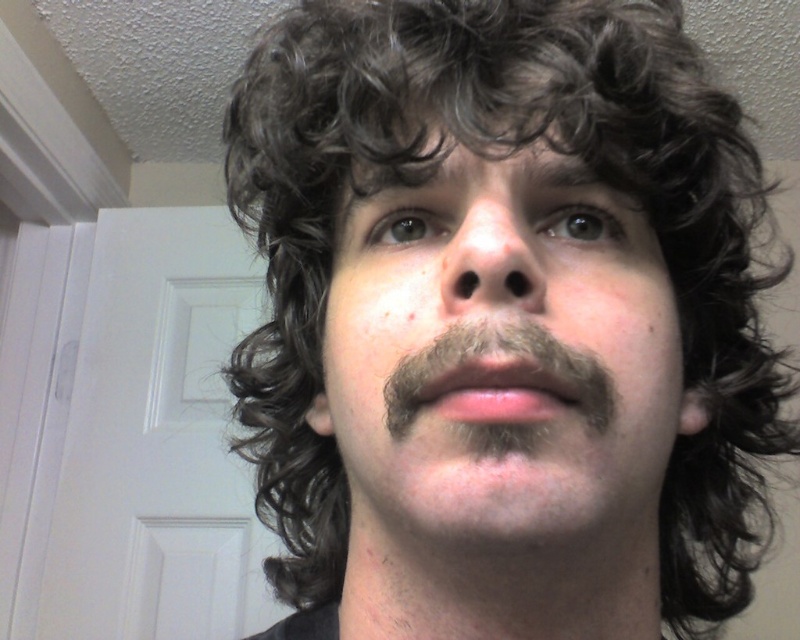
You are a barber who needs to trim the dark curly hair at center and the dark brown fuzzy mustache at center. Which one requires a longer blade length to accommodate its height?

The dark curly hair at center is much taller than the dark brown fuzzy mustache at center, so the barber should use a longer blade length for the dark curly hair at center.

Looking at this image, you are standing in front of a person whose face is shown in the image. You notice two points marked on their face at coordinates point (366, 428) and point (562, 372). Which point is closer to you?

Point (366, 428) is closer to you because it is further to the viewer than point (562, 372).